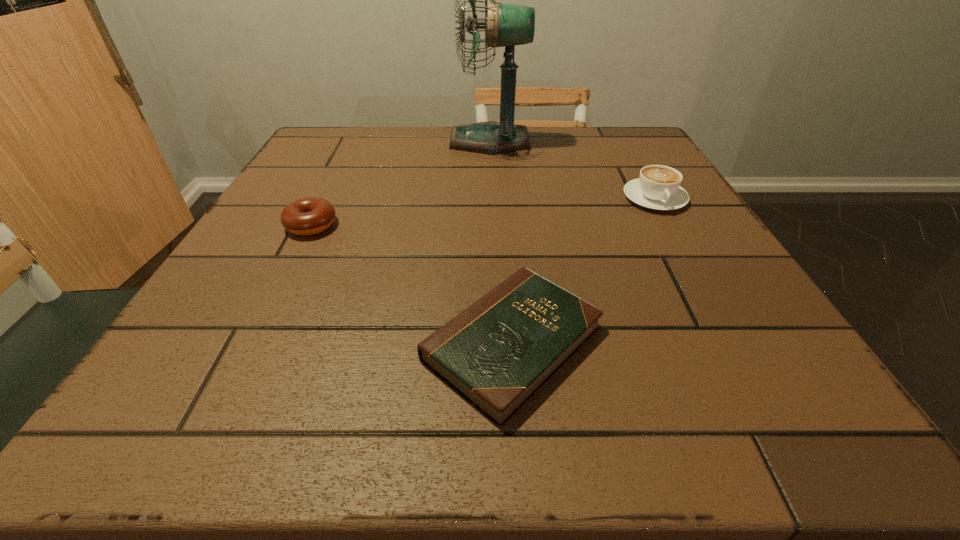
At what (x,y) coordinates should I click in order to perform the action: click on fan. Please return your answer as a coordinate pair (x, y). The image size is (960, 540). Looking at the image, I should click on (506, 25).

Locate an element on the screen. The image size is (960, 540). the farthest object is located at coordinates (506, 25).

You are a GUI agent. You are given a task and a screenshot of the screen. Output one action in this format:
    pyautogui.click(x=<x>, y=<y>)
    Task: Click on the cappuccino
    
    Given the screenshot: What is the action you would take?
    pyautogui.click(x=658, y=187)

This screenshot has height=540, width=960. What are the coordinates of `the second tallest object` in the screenshot? It's located at (658, 187).

Locate an element on the screen. The height and width of the screenshot is (540, 960). the third tallest object is located at coordinates (307, 216).

The width and height of the screenshot is (960, 540). What are the coordinates of `the leftmost object` in the screenshot? It's located at (307, 216).

The width and height of the screenshot is (960, 540). What are the coordinates of `the nearest object` in the screenshot? It's located at (497, 353).

At what (x,y) coordinates should I click in order to perform the action: click on Bible. Please return your answer as a coordinate pair (x, y). Image resolution: width=960 pixels, height=540 pixels. Looking at the image, I should click on (497, 353).

This screenshot has width=960, height=540. Identify the location of vacant space located in front of the farthest object where the wind blows. (395, 141).

Identify the location of vacant space located in front of the farthest object where the wind blows. The width and height of the screenshot is (960, 540). (343, 141).